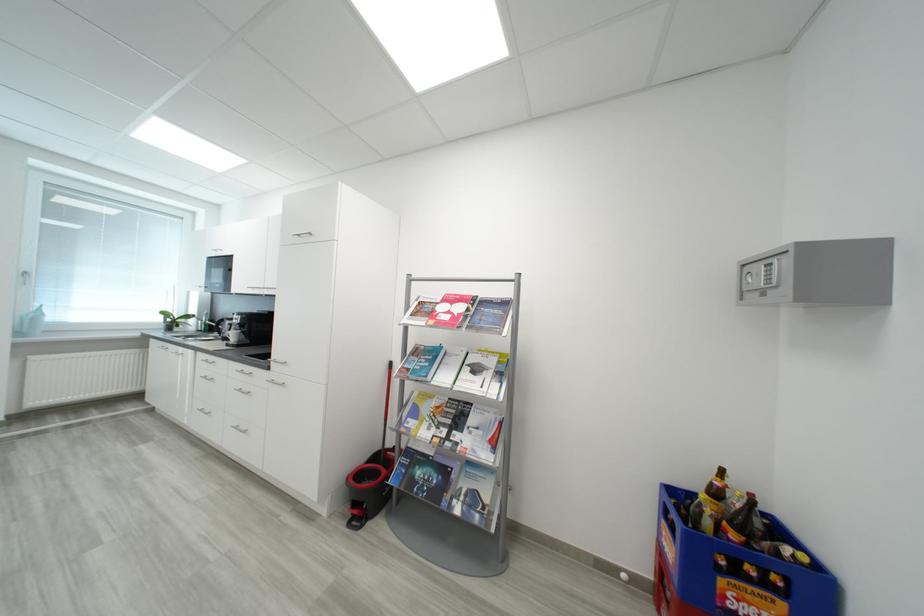
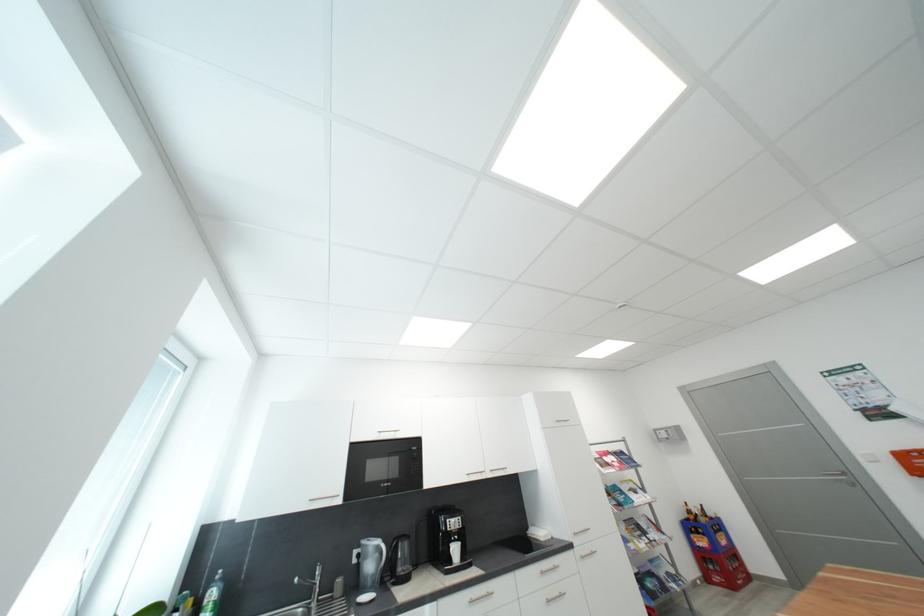
In the second image, find the point that corresponds to point 714,524 in the first image.

(710, 522)